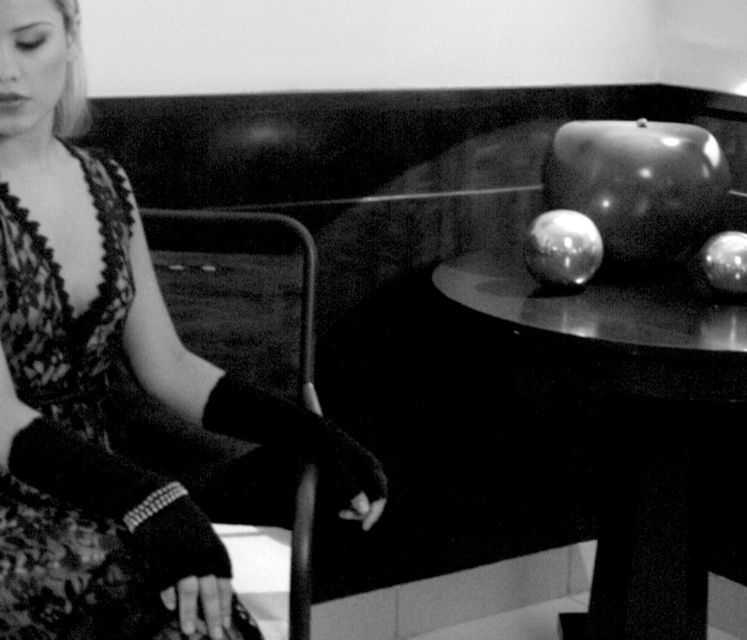
Does lace fabric dress at left have a greater width compared to glossy metallic apple at right?

Correct, the width of lace fabric dress at left exceeds that of glossy metallic apple at right.

Does lace fabric dress at left have a smaller size compared to glossy metallic apple at right?

No, lace fabric dress at left is not smaller than glossy metallic apple at right.

Is point (10, 275) closer to viewer compared to point (728, 237)?

Yes, point (10, 275) is in front of point (728, 237).

You are a GUI agent. You are given a task and a screenshot of the screen. Output one action in this format:
    pyautogui.click(x=<x>, y=<y>)
    Task: Click on the lace fabric dress at left
    Image resolution: width=747 pixels, height=640 pixels.
    Given the screenshot: What is the action you would take?
    pyautogui.click(x=80, y=445)

Is the position of lace fabric dress at left less distant than that of glossy metallic apple at center?

Yes, lace fabric dress at left is closer to the viewer.

Which is behind, point (89, 168) or point (565, 260)?

The point (565, 260) is behind.

Find the location of a particular element. This screenshot has height=640, width=747. lace fabric dress at left is located at coordinates (80, 445).

Which is behind, point (651, 561) or point (583, 244)?

Point (651, 561)

Can you confirm if glossy metallic table at upper right is positioned to the left of glossy metallic apple at center?

No, glossy metallic table at upper right is not to the left of glossy metallic apple at center.

This screenshot has height=640, width=747. I want to click on glossy metallic table at upper right, so click(x=627, y=419).

You are a GUI agent. You are given a task and a screenshot of the screen. Output one action in this format:
    pyautogui.click(x=<x>, y=<y>)
    Task: Click on the glossy metallic table at upper right
    The image size is (747, 640).
    Given the screenshot: What is the action you would take?
    pyautogui.click(x=627, y=419)